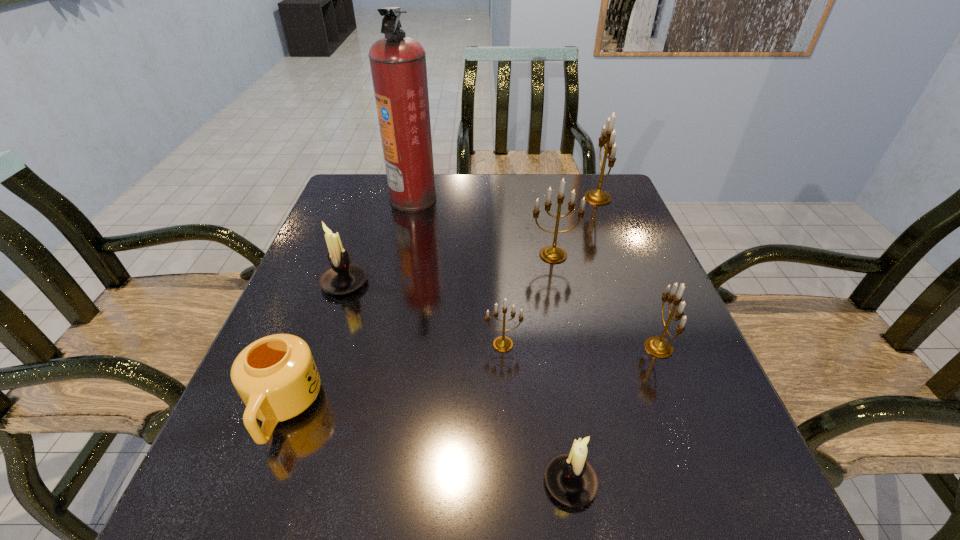
I want to click on red fire extinguisher, so (398, 63).

Find the location of `fire extinguisher`. fire extinguisher is located at coordinates (398, 63).

This screenshot has height=540, width=960. Find the location of `the second tallest object`. the second tallest object is located at coordinates (597, 197).

At what (x,y) coordinates should I click in order to perform the action: click on the farthest candelabrum. Please return your answer as a coordinate pair (x, y). This screenshot has height=540, width=960. Looking at the image, I should click on (597, 197).

At what (x,y) coordinates should I click in order to perform the action: click on the second farthest candelabrum. Please return your answer as a coordinate pair (x, y). The height and width of the screenshot is (540, 960). Looking at the image, I should click on (552, 254).

Identify the location of the third gold candelabrum from right to left. The width and height of the screenshot is (960, 540). (552, 254).

Identify the location of the third farthest candelabrum. (343, 277).

The image size is (960, 540). In order to click on the leftmost candelabrum in this screenshot , I will do `click(343, 277)`.

At what (x,y) coordinates should I click in order to perform the action: click on the second smallest gold candelabrum. Please return your answer as a coordinate pair (x, y). Looking at the image, I should click on (659, 347).

The width and height of the screenshot is (960, 540). I want to click on the nearer white candle holder, so 571,480.